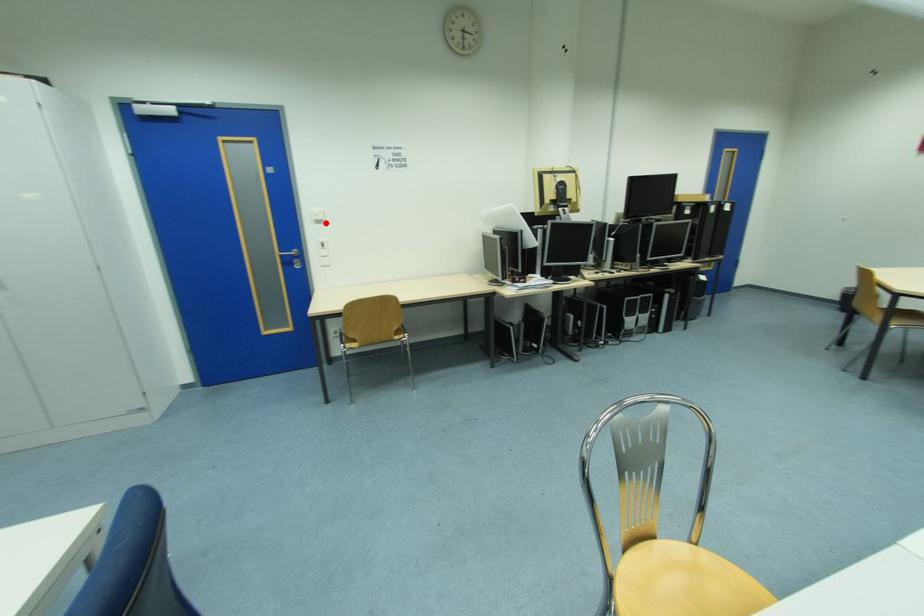
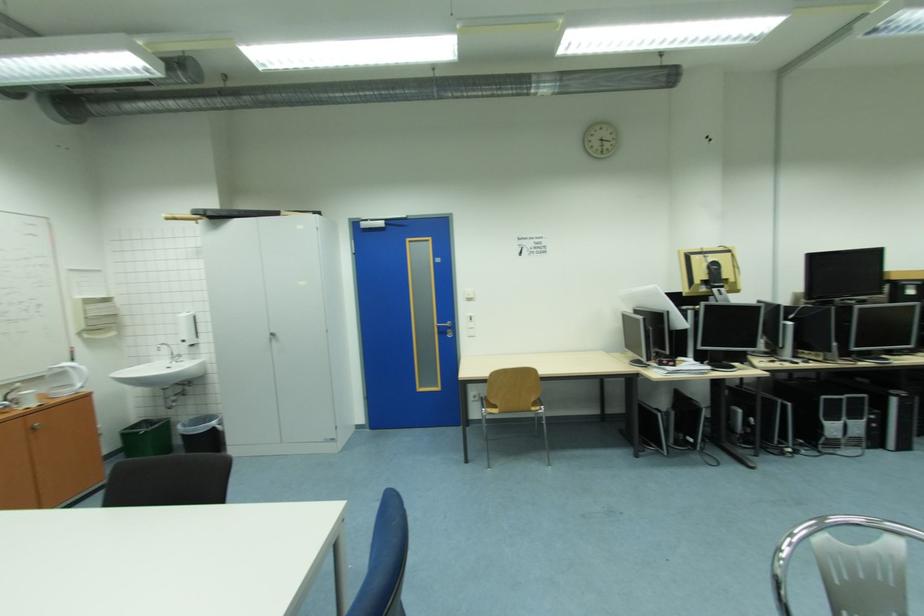
Where in the second image is the point corresponding to the highlighted location from the first image?

(477, 301)